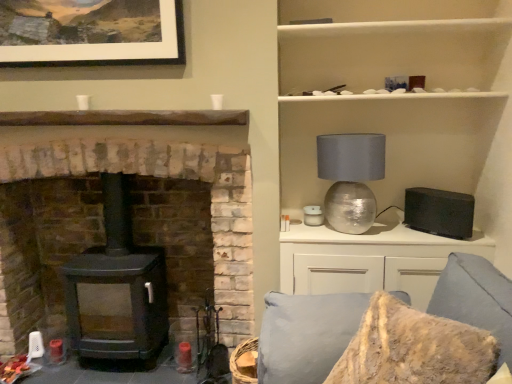
Question: From a real-world perspective, is black matte speaker at right below matte black wood stove at left?

Choices:
 (A) yes
 (B) no

Answer: (B)

Question: Can you confirm if black matte speaker at right is bigger than matte black wood stove at left?

Choices:
 (A) yes
 (B) no

Answer: (B)

Question: Can you confirm if black matte speaker at right is wider than matte black wood stove at left?

Choices:
 (A) no
 (B) yes

Answer: (A)

Question: From the image's perspective, is black matte speaker at right under matte black wood stove at left?

Choices:
 (A) yes
 (B) no

Answer: (B)

Question: Does black matte speaker at right appear on the left side of matte black wood stove at left?

Choices:
 (A) yes
 (B) no

Answer: (B)

Question: From their relative heights in the image, would you say black matte wood burning stove at left is taller or shorter than matte black wood stove at left?

Choices:
 (A) tall
 (B) short

Answer: (B)

Question: In terms of width, does black matte wood burning stove at left look wider or thinner when compared to matte black wood stove at left?

Choices:
 (A) thin
 (B) wide

Answer: (A)

Question: From a real-world perspective, relative to matte black wood stove at left, is black matte wood burning stove at left vertically above or below?

Choices:
 (A) above
 (B) below

Answer: (B)

Question: Based on their positions, is black matte wood burning stove at left located to the left or right of matte black wood stove at left?

Choices:
 (A) left
 (B) right

Answer: (B)

Question: Is metallic silver sphere at upper right wider or thinner than matte white picture frame at upper center?

Choices:
 (A) wide
 (B) thin

Answer: (A)

Question: Is metallic silver sphere at upper right taller or shorter than matte white picture frame at upper center?

Choices:
 (A) short
 (B) tall

Answer: (B)

Question: Looking at the image, does metallic silver sphere at upper right seem bigger or smaller compared to matte white picture frame at upper center?

Choices:
 (A) big
 (B) small

Answer: (A)

Question: Considering their positions, is metallic silver sphere at upper right located in front of or behind matte white picture frame at upper center?

Choices:
 (A) behind
 (B) front

Answer: (A)

Question: Is textured gray couch at lower right wider or thinner than white matte cabinet at upper right?

Choices:
 (A) wide
 (B) thin

Answer: (A)

Question: From their relative heights in the image, would you say textured gray couch at lower right is taller or shorter than white matte cabinet at upper right?

Choices:
 (A) short
 (B) tall

Answer: (B)